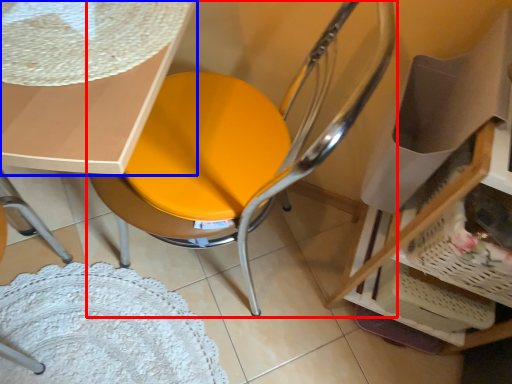
Question: Which object appears farthest to the camera in this image, chair (highlighted by a red box) or table (highlighted by a blue box)?

Choices:
 (A) chair
 (B) table

Answer: (B)